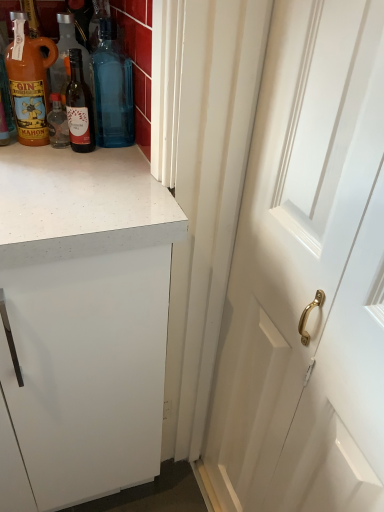
In order to face matte orange bottle at left, the 1th bottle when ordered from left to right, should I rotate leftwards or rightwards?

You should look left and rotate roughly 20.433 degrees.

The height and width of the screenshot is (512, 384). What do you see at coordinates (79, 106) in the screenshot?
I see `matte glass bottle at upper center, which is the 2th bottle in left-to-right order` at bounding box center [79, 106].

Where is `blue glass bottle at upper center, which is counted as the 3th bottle, starting from the left`? blue glass bottle at upper center, which is counted as the 3th bottle, starting from the left is located at coordinates (112, 89).

At what (x,y) coordinates should I click in order to perform the action: click on matte orange bottle at left, the third bottle in the right-to-left sequence. Please return your answer as a coordinate pair (x, y). The image size is (384, 512). Looking at the image, I should click on [29, 82].

Which is in front, point (126, 89) or point (25, 66)?

The point (25, 66) is more forward.

Considering the positions of objects blue glass bottle at upper center, which is counted as the 3th bottle, starting from the left, and matte orange bottle at left, the third bottle in the right-to-left sequence, in the image provided, who is more to the right, blue glass bottle at upper center, which is counted as the 3th bottle, starting from the left, or matte orange bottle at left, the third bottle in the right-to-left sequence,?

blue glass bottle at upper center, which is counted as the 3th bottle, starting from the left, is more to the right.

Is blue glass bottle at upper center, which ranks as the first bottle in right-to-left order, next to matte orange bottle at left, the 1th bottle when ordered from left to right, and touching it?

blue glass bottle at upper center, which ranks as the first bottle in right-to-left order, and matte orange bottle at left, the 1th bottle when ordered from left to right, are not in contact.

There is a blue glass bottle at upper center, which ranks as the first bottle in right-to-left order. Where is `the 1st bottle below it (from a real-world perspective)`? This screenshot has height=512, width=384. the 1st bottle below it (from a real-world perspective) is located at coordinates (29, 82).

From the picture: Considering the relative sizes of white wooden door at right and matte orange bottle at left, the third bottle in the right-to-left sequence, in the image provided, is white wooden door at right wider than matte orange bottle at left, the third bottle in the right-to-left sequence,?

In fact, white wooden door at right might be narrower than matte orange bottle at left, the third bottle in the right-to-left sequence.

Can you confirm if white wooden door at right is positioned to the right of matte orange bottle at left, the 1th bottle when ordered from left to right?

Indeed, white wooden door at right is positioned on the right side of matte orange bottle at left, the 1th bottle when ordered from left to right.

From a real-world perspective, is white wooden door at right below matte orange bottle at left, the third bottle in the right-to-left sequence?

Indeed, from a real-world perspective, white wooden door at right is positioned beneath matte orange bottle at left, the third bottle in the right-to-left sequence.

This screenshot has width=384, height=512. Identify the location of the 3rd bottle counting from the left side of the white wooden door at right. (29, 82).

Would you say white wooden door at right is outside blue glass bottle at upper center, which is counted as the 3th bottle, starting from the left?

white wooden door at right is positioned outside blue glass bottle at upper center, which is counted as the 3th bottle, starting from the left.

From a real-world perspective, is white wooden door at right physically below blue glass bottle at upper center, which is counted as the 3th bottle, starting from the left?

Correct, in the physical world, white wooden door at right is lower than blue glass bottle at upper center, which is counted as the 3th bottle, starting from the left.

How different are the orientations of white wooden door at right and blue glass bottle at upper center, which ranks as the first bottle in right-to-left order, in degrees?

90 degrees separate the facing orientations of white wooden door at right and blue glass bottle at upper center, which ranks as the first bottle in right-to-left order.

Considering the positions of objects white wooden door at right and blue glass bottle at upper center, which is counted as the 3th bottle, starting from the left, in the image provided, who is more to the right, white wooden door at right or blue glass bottle at upper center, which is counted as the 3th bottle, starting from the left,?

white wooden door at right.

Does point (17, 12) appear closer or farther from the camera than point (122, 120)?

Point (17, 12) is positioned closer to the camera compared to point (122, 120).

Considering the sizes of objects matte orange bottle at left, the 1th bottle when ordered from left to right, and blue glass bottle at upper center, which is counted as the 3th bottle, starting from the left, in the image provided, who is shorter, matte orange bottle at left, the 1th bottle when ordered from left to right, or blue glass bottle at upper center, which is counted as the 3th bottle, starting from the left,?

matte orange bottle at left, the 1th bottle when ordered from left to right.

From a real-world perspective, is matte orange bottle at left, the 1th bottle when ordered from left to right, physically located above or below blue glass bottle at upper center, which is counted as the 3th bottle, starting from the left?

From a real-world perspective, matte orange bottle at left, the 1th bottle when ordered from left to right, is physically below blue glass bottle at upper center, which is counted as the 3th bottle, starting from the left.

Which is more to the right, matte orange bottle at left, the 1th bottle when ordered from left to right, or blue glass bottle at upper center, which ranks as the first bottle in right-to-left order?

Positioned to the right is blue glass bottle at upper center, which ranks as the first bottle in right-to-left order.

Visually, is matte orange bottle at left, the third bottle in the right-to-left sequence, positioned to the left or to the right of matte glass bottle at upper center, which is the 2th bottle in left-to-right order?

Clearly, matte orange bottle at left, the third bottle in the right-to-left sequence, is on the left of matte glass bottle at upper center, which is the 2th bottle in left-to-right order, in the image.

Could you tell me if matte orange bottle at left, the third bottle in the right-to-left sequence, is turned towards matte glass bottle at upper center, which is the 2th bottle in left-to-right order?

No, matte orange bottle at left, the third bottle in the right-to-left sequence, is not turned towards matte glass bottle at upper center, which is the 2th bottle in left-to-right order.

Where is `bottle in front of the matte glass bottle at upper center, which is the 2th bottle in left-to-right order`? This screenshot has height=512, width=384. bottle in front of the matte glass bottle at upper center, which is the 2th bottle in left-to-right order is located at coordinates (29, 82).

Is point (130, 75) positioned behind point (76, 82)?

No, (130, 75) is in front of (76, 82).

Is blue glass bottle at upper center, which ranks as the first bottle in right-to-left order, thinner than matte glass bottle at upper center, marked as the second bottle in a right-to-left arrangement?

In fact, blue glass bottle at upper center, which ranks as the first bottle in right-to-left order, might be wider than matte glass bottle at upper center, marked as the second bottle in a right-to-left arrangement.

Which is in front, blue glass bottle at upper center, which is counted as the 3th bottle, starting from the left, or matte glass bottle at upper center, which is the 2th bottle in left-to-right order?

matte glass bottle at upper center, which is the 2th bottle in left-to-right order, is more forward.

How different are the orientations of blue glass bottle at upper center, which ranks as the first bottle in right-to-left order, and white wooden door at right in degrees?

They differ by 90 degrees in their facing directions.

In the image, is blue glass bottle at upper center, which ranks as the first bottle in right-to-left order, positioned in front of or behind white wooden door at right?

Visually, blue glass bottle at upper center, which ranks as the first bottle in right-to-left order, is located behind white wooden door at right.

Considering the positions of points (132, 134) and (365, 418), is point (132, 134) farther from camera compared to point (365, 418)?

That is True.

From the image's perspective, starting from the white wooden door at right, which bottle is the 3rd one above? Please provide its 2D coordinates.

[(112, 89)]

From the matte orange bottle at left, the third bottle in the right-to-left sequence, count 2nd bottles backward and point to it. Please provide its 2D coordinates.

[(112, 89)]

Where is `door directly beneath the matte orange bottle at left, the third bottle in the right-to-left sequence (from a real-world perspective)`? The image size is (384, 512). door directly beneath the matte orange bottle at left, the third bottle in the right-to-left sequence (from a real-world perspective) is located at coordinates (308, 275).

When comparing their distances from white wooden door at right, does matte glass bottle at upper center, which is the 2th bottle in left-to-right order, or matte orange bottle at left, the third bottle in the right-to-left sequence, seem closer?

The object closer to white wooden door at right is matte glass bottle at upper center, which is the 2th bottle in left-to-right order.

Looking at the image, which one is located further to white wooden door at right, matte glass bottle at upper center, marked as the second bottle in a right-to-left arrangement, or blue glass bottle at upper center, which is counted as the 3th bottle, starting from the left?

matte glass bottle at upper center, marked as the second bottle in a right-to-left arrangement, is positioned further to the anchor white wooden door at right.

Looking at the image, which one is located further to white wooden door at right, blue glass bottle at upper center, which ranks as the first bottle in right-to-left order, or matte orange bottle at left, the 1th bottle when ordered from left to right?

Among the two, matte orange bottle at left, the 1th bottle when ordered from left to right, is located further to white wooden door at right.

Looking at the image, which one is located further to blue glass bottle at upper center, which is counted as the 3th bottle, starting from the left, matte orange bottle at left, the 1th bottle when ordered from left to right, or white wooden door at right?

white wooden door at right lies further to blue glass bottle at upper center, which is counted as the 3th bottle, starting from the left, than the other object.

From the image, which object appears to be farther from matte glass bottle at upper center, marked as the second bottle in a right-to-left arrangement, blue glass bottle at upper center, which is counted as the 3th bottle, starting from the left, or white wooden door at right?

white wooden door at right is positioned further to the anchor matte glass bottle at upper center, marked as the second bottle in a right-to-left arrangement.

Which object lies further to the anchor point matte glass bottle at upper center, marked as the second bottle in a right-to-left arrangement, white wooden door at right or blue glass bottle at upper center, which ranks as the first bottle in right-to-left order?

white wooden door at right.

When comparing their distances from blue glass bottle at upper center, which ranks as the first bottle in right-to-left order, does matte glass bottle at upper center, which is the 2th bottle in left-to-right order, or matte orange bottle at left, the 1th bottle when ordered from left to right, seem further?

matte orange bottle at left, the 1th bottle when ordered from left to right, is positioned further to the anchor blue glass bottle at upper center, which ranks as the first bottle in right-to-left order.

Which object lies nearer to the anchor point blue glass bottle at upper center, which is counted as the 3th bottle, starting from the left, white wooden door at right or matte glass bottle at upper center, which is the 2th bottle in left-to-right order?

matte glass bottle at upper center, which is the 2th bottle in left-to-right order, lies closer to blue glass bottle at upper center, which is counted as the 3th bottle, starting from the left, than the other object.

Find the location of `bottle that lies between matte orange bottle at left, the third bottle in the right-to-left sequence, and white wooden door at right from top to bottom`. bottle that lies between matte orange bottle at left, the third bottle in the right-to-left sequence, and white wooden door at right from top to bottom is located at coordinates (79, 106).

I want to click on bottle situated between matte orange bottle at left, the 1th bottle when ordered from left to right, and blue glass bottle at upper center, which is counted as the 3th bottle, starting from the left, from left to right, so point(79,106).